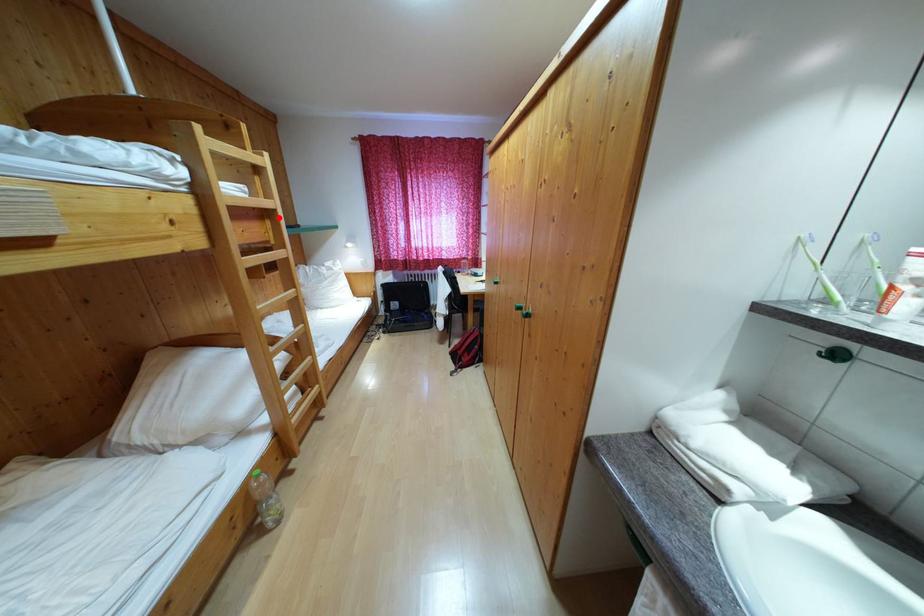
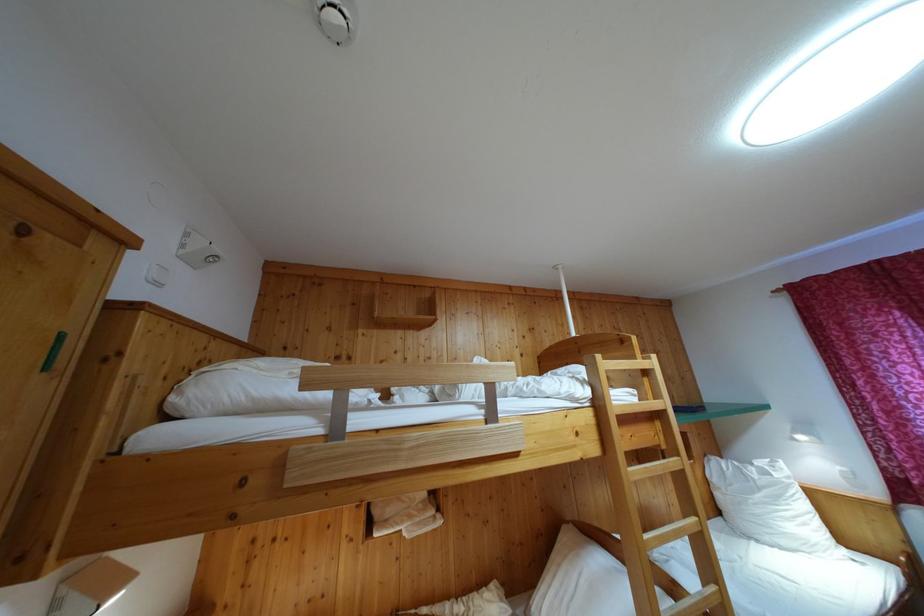
Find the pixel in the second image that matches the highlighted location in the first image.

(669, 418)